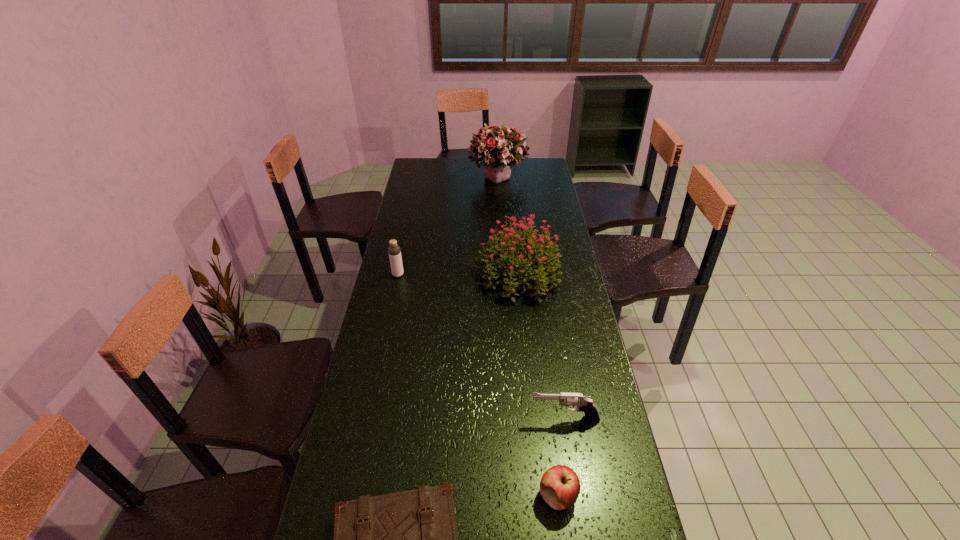
I want to click on free space located at the muzzle of the gun, so click(x=500, y=418).

I want to click on vacant area located at the muzzle of the gun, so click(x=394, y=418).

Where is `free space located 0.080m on the back of the second shortest object`? free space located 0.080m on the back of the second shortest object is located at coordinates (552, 448).

Locate an element on the screen. The height and width of the screenshot is (540, 960). object that is at the far edge is located at coordinates (499, 148).

Identify the location of object located in the left edge section of the desktop. The height and width of the screenshot is (540, 960). (394, 251).

Where is `gun that is at the right edge`? gun that is at the right edge is located at coordinates (584, 404).

Where is `apple at the right edge`? The width and height of the screenshot is (960, 540). apple at the right edge is located at coordinates (560, 487).

Image resolution: width=960 pixels, height=540 pixels. Find the location of `object that is at the far right corner`. object that is at the far right corner is located at coordinates (499, 148).

You are a GUI agent. You are given a task and a screenshot of the screen. Output one action in this format:
    pyautogui.click(x=<x>, y=<y>)
    Task: Click on the free location at the far edge
    The image size is (960, 540).
    Given the screenshot: What is the action you would take?
    pyautogui.click(x=461, y=168)

In the image, there is a desktop. What are the coordinates of `vacant space at the left edge` in the screenshot? It's located at (421, 187).